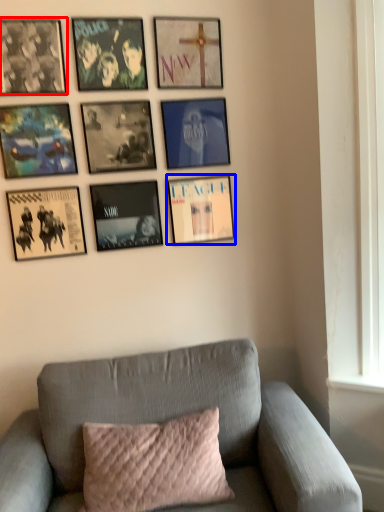
Question: Which point is further to the camera, picture frame (highlighted by a red box) or picture frame (highlighted by a blue box)?

Choices:
 (A) picture frame
 (B) picture frame

Answer: (B)